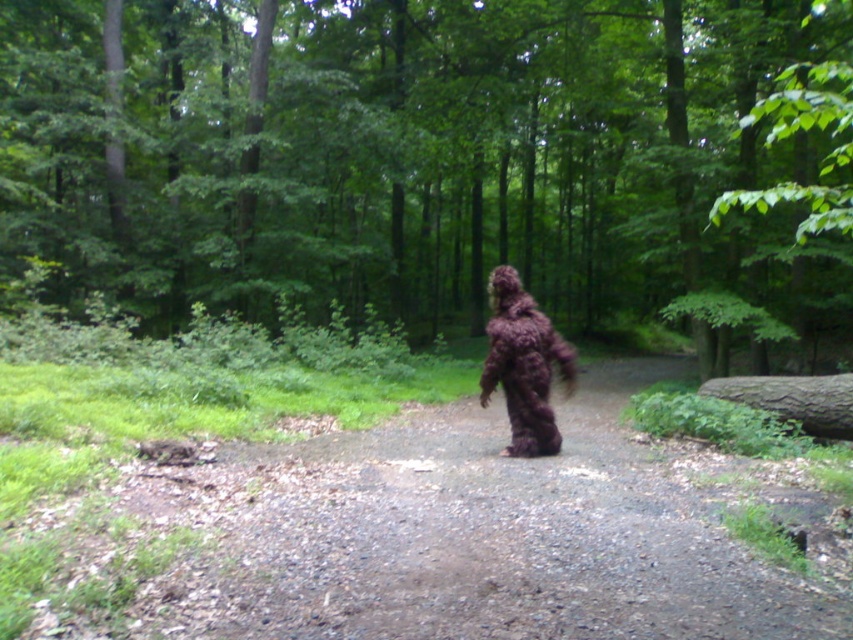
Question: Is brown furry suit at center further to the viewer compared to fuzzy camouflage suit at center?

Choices:
 (A) yes
 (B) no

Answer: (A)

Question: Which point is closer to the camera?

Choices:
 (A) fuzzy camouflage suit at center
 (B) brown furry suit at center

Answer: (A)

Question: Among these objects, which one is farthest from the camera?

Choices:
 (A) fuzzy camouflage suit at center
 (B) brown furry suit at center

Answer: (B)

Question: Is brown furry suit at center above fuzzy camouflage suit at center?

Choices:
 (A) no
 (B) yes

Answer: (B)

Question: Does brown furry suit at center have a larger size compared to fuzzy camouflage suit at center?

Choices:
 (A) no
 (B) yes

Answer: (B)